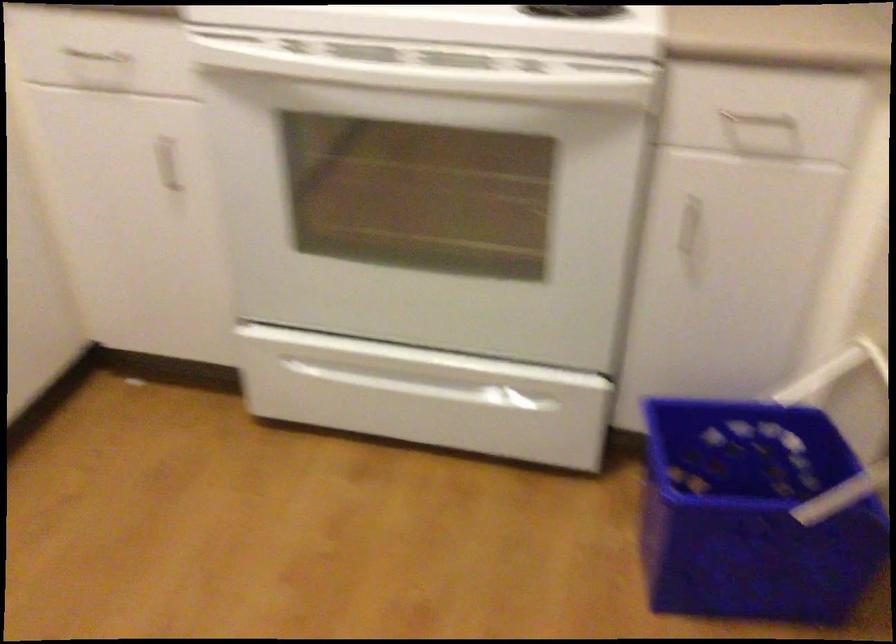
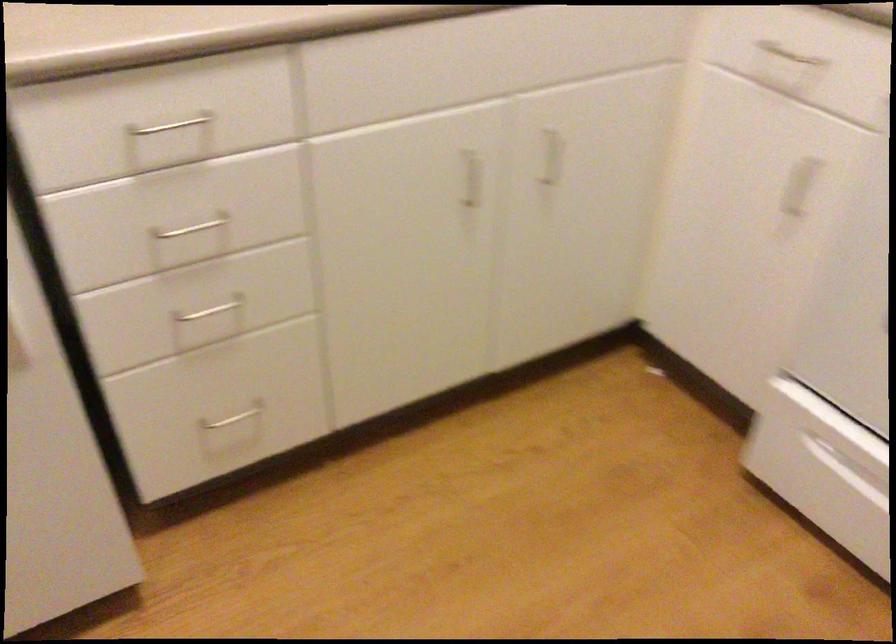
Question: Based on the continuous images, in which direction is the camera rotating? Reply with the corresponding letter.

Choices:
 (A) Left
 (B) Right
 (C) Up
 (D) Down

Answer: (A)